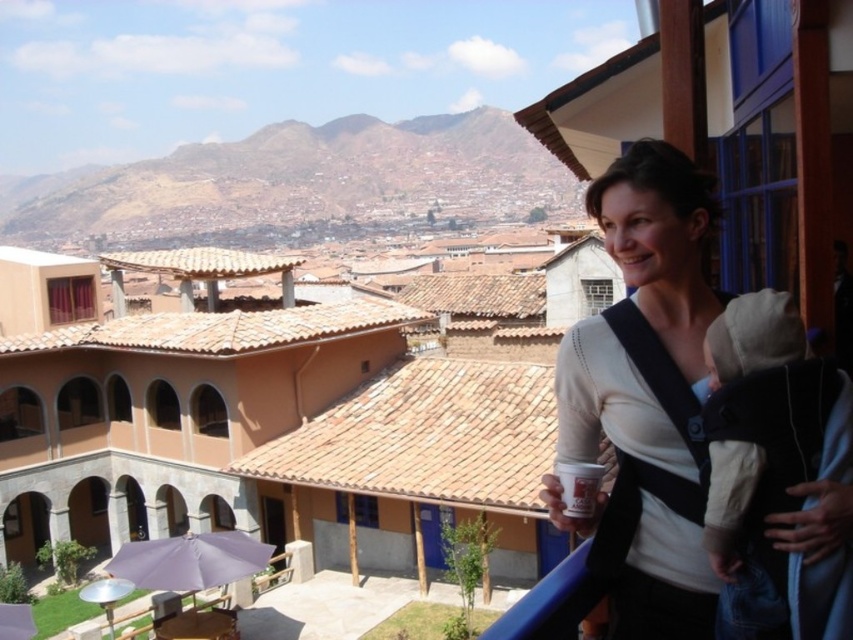
You are standing on the balcony and want to throw a small ball from the white matte sweater at upper right to the purple fabric umbrella at lower left. Can the ball reach the umbrella if the maximum throwing distance you can achieve is 14 meters?

The distance between the white matte sweater at upper right and the purple fabric umbrella at lower left is 15.25 meters. Since your maximum throwing distance is 14 meters, the ball cannot reach the umbrella.

You are standing on the balcony and want to place a small potted plant between the white matte sweater at upper right and the purple fabric umbrella at lower left. Based on their positions, which object should the plant be closer to?

The white matte sweater at upper right is positioned on the right side of the purple fabric umbrella at lower left, so the plant should be placed closer to the purple fabric umbrella at lower left to maintain balance between the two objects.

You are a tailor who needs to determine which item is taller between the white matte sweater at upper right and the purple fabric umbrella at lower left. Based on the scene, which one is taller?

The white matte sweater at upper right is taller than the purple fabric umbrella at lower left according to the description.